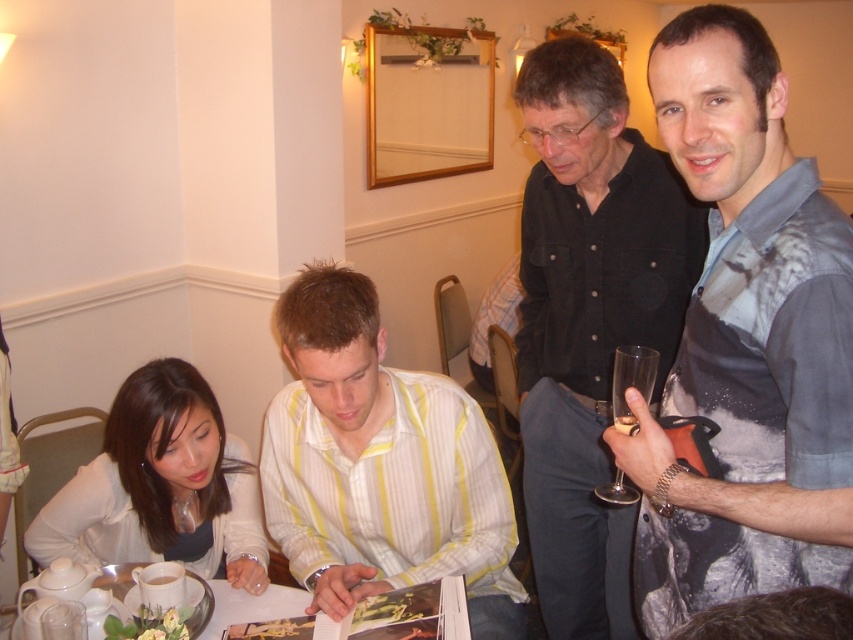
Who is positioned more to the left, printed cotton shirt at center or yellow striped shirt at center?

Positioned to the left is yellow striped shirt at center.

Based on the photo, does printed cotton shirt at center have a larger size compared to yellow striped shirt at center?

Actually, printed cotton shirt at center might be smaller than yellow striped shirt at center.

At what (x,y) coordinates should I click in order to perform the action: click on printed cotton shirt at center. Please return your answer as a coordinate pair (x, y). This screenshot has width=853, height=640. Looking at the image, I should click on (746, 342).

Between printed cotton shirt at center and black shirt at upper right, which one appears on the left side from the viewer's perspective?

black shirt at upper right is more to the left.

Where is `printed cotton shirt at center`? Image resolution: width=853 pixels, height=640 pixels. printed cotton shirt at center is located at coordinates (746, 342).

Which is behind, point (805, 360) or point (584, 474)?

The point (584, 474) is behind.

Identify the location of printed cotton shirt at center. (746, 342).

How distant is black shirt at upper right from yellow striped shirt at center?

black shirt at upper right is 43.94 centimeters away from yellow striped shirt at center.

Who is more distant from viewer, (686,204) or (350,301)?

Positioned behind is point (686,204).

Does point (602, 611) lie behind point (392, 369)?

Yes.

You are a GUI agent. You are given a task and a screenshot of the screen. Output one action in this format:
    pyautogui.click(x=<x>, y=<y>)
    Task: Click on the black shirt at upper right
    
    Given the screenshot: What is the action you would take?
    pyautogui.click(x=589, y=317)